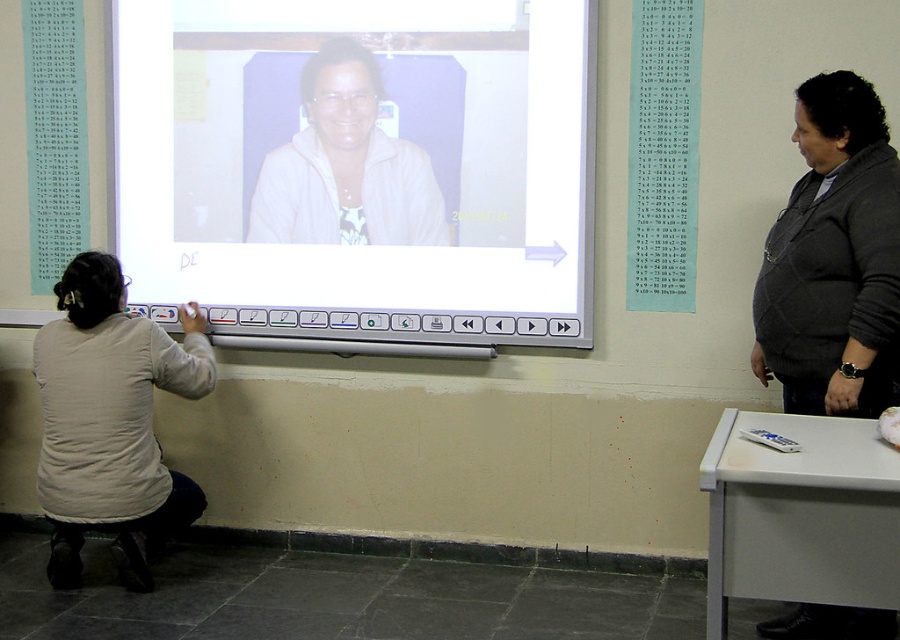
You are a student in the classroom and need to write a note on the white glossy projector screen at center. However, you notice the dark gray sweater at right is blocking your view. Can you move the sweater to access the screen?

The white glossy projector screen at center is located above the dark gray sweater at right, so you can move the dark gray sweater at right to access the screen since it is below the screen.

You are a student sitting in the classroom and notice two items in the scene. One is the light beige fabric shirt at lower left and the other is the white matte jacket at upper center. Which item is located to the left of the other?

The light beige fabric shirt at lower left is positioned on the left side of white matte jacket at upper center.

You are a student in the classroom and you see the light beige fabric shirt at lower left and the white matte jacket at upper center. Which one is closer to the bottom of the image?

The light beige fabric shirt at lower left is closer to the bottom of the image because it is located below the white matte jacket at upper center.